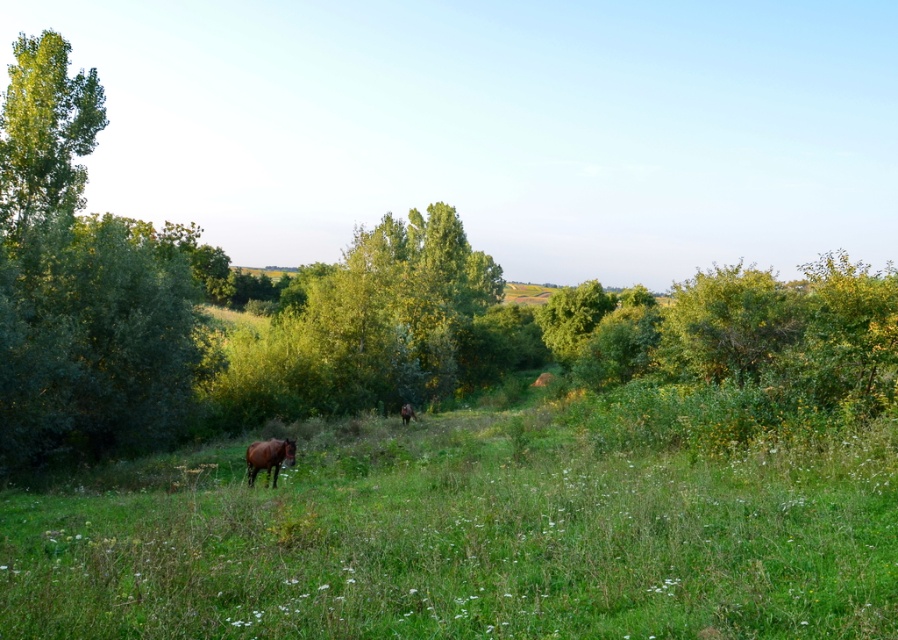
You are standing in the middle of the field and see the green grass at lower center and the green leafy tree at upper left. Which object is nearer to you?

The green grass at lower center is closer to the viewer than the green leafy tree at upper left.

You are a hiker carrying a 2.5 meter long ladder. You need to place the ladder between the green leafy tree at left and the green leafy tree at upper left. Can the ladder fit horizontally between them?

The distance between the green leafy tree at left and the green leafy tree at upper left is 9.25 meters. Since the ladder is only 2.5 meters long, it can easily fit horizontally between them.